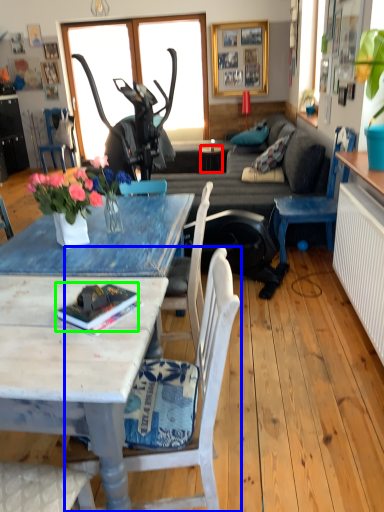
Question: Based on their relative distances, which object is nearer to side table (highlighted by a red box)? Choose from chair (highlighted by a blue box) and book (highlighted by a green box).

Choices:
 (A) chair
 (B) book

Answer: (A)